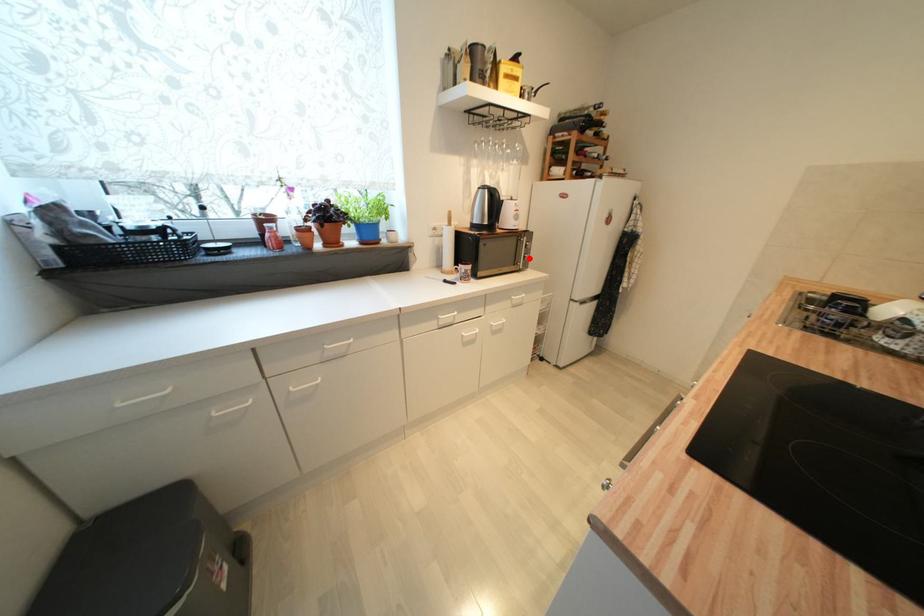
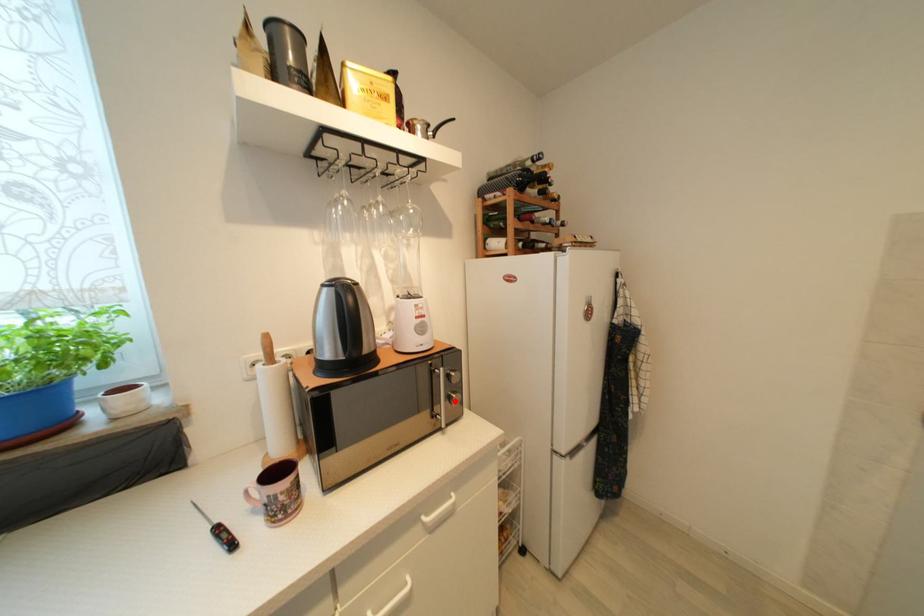
I am providing you with two images of the same scene from different viewpoints. A red point is marked on the first image and another point is marked on the second image. Do the highlighted points in image1 and image2 indicate the same real-world spot?

Yes